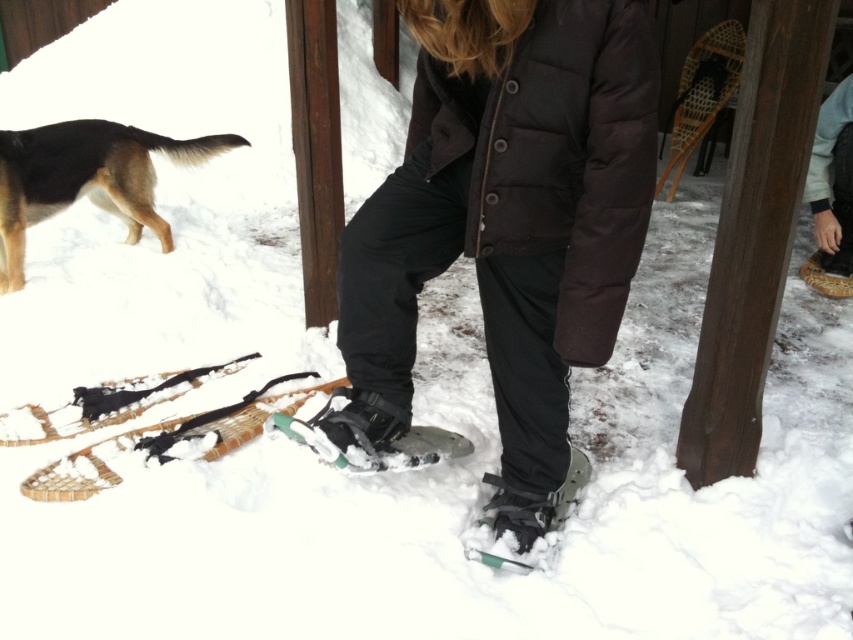
Is the position of brown fur dog at upper left more distant than that of green rubber snowshoe at lower center?

Yes, it is behind green rubber snowshoe at lower center.

From the picture: Is brown fur dog at upper left wider than green rubber snowshoe at lower center?

Indeed, brown fur dog at upper left has a greater width compared to green rubber snowshoe at lower center.

Describe the element at coordinates (86, 179) in the screenshot. I see `brown fur dog at upper left` at that location.

You are a GUI agent. You are given a task and a screenshot of the screen. Output one action in this format:
    pyautogui.click(x=<x>, y=<y>)
    Task: Click on the brown fur dog at upper left
    Image resolution: width=853 pixels, height=640 pixels.
    Given the screenshot: What is the action you would take?
    pyautogui.click(x=86, y=179)

Is point (833, 125) closer to camera compared to point (515, 566)?

No, (833, 125) is further to viewer.

Can you confirm if gray fleece jacket at upper right is positioned to the left of green rubber snowshoe at lower center?

No, gray fleece jacket at upper right is not to the left of green rubber snowshoe at lower center.

At what (x,y) coordinates should I click in order to perform the action: click on gray fleece jacket at upper right. Please return your answer as a coordinate pair (x, y). Looking at the image, I should click on (833, 180).

Find the location of `gray fleece jacket at upper right`. gray fleece jacket at upper right is located at coordinates (833, 180).

How distant is matte black snowshoes at center from green rubber snowshoe at center?

matte black snowshoes at center and green rubber snowshoe at center are 42.08 centimeters apart from each other.

Which is more to the left, matte black snowshoes at center or green rubber snowshoe at center?

green rubber snowshoe at center

I want to click on matte black snowshoes at center, so 506,221.

At what (x,y) coordinates should I click in order to perform the action: click on matte black snowshoes at center. Please return your answer as a coordinate pair (x, y). Looking at the image, I should click on (506, 221).